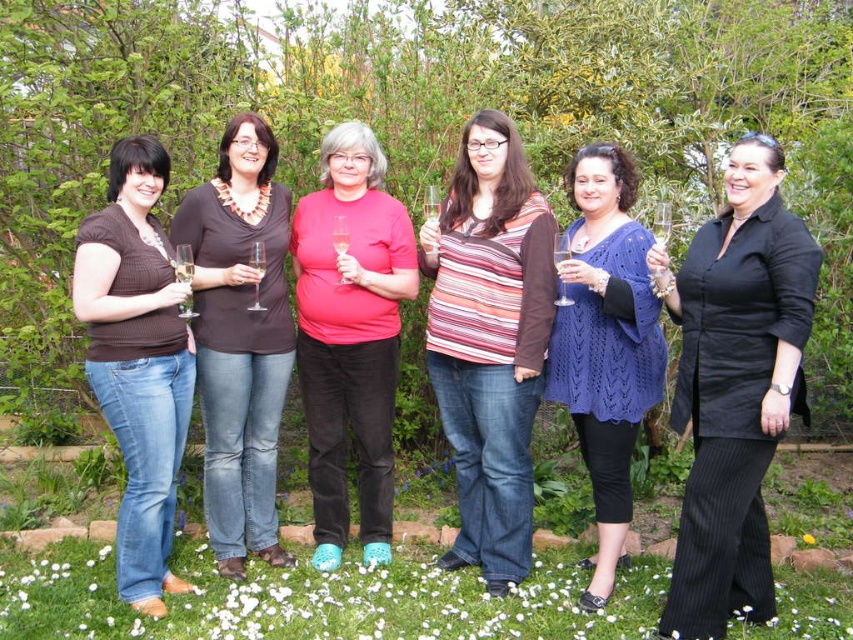
Question: Does white fabric flower at lower center have a greater width compared to yellow fabric flower at center?

Choices:
 (A) yes
 (B) no

Answer: (A)

Question: Which object is positioned closest to the striped knit top at center?

Choices:
 (A) matte brown blouse at center
 (B) knitted blue sweater at center

Answer: (B)

Question: Which object is farther from the camera taking this photo?

Choices:
 (A) matte brown shirt at left
 (B) black pinstripe dress at right

Answer: (A)

Question: Among these points, which one is farthest from the camera?

Choices:
 (A) (608, 230)
 (B) (173, 456)

Answer: (A)

Question: Can you confirm if black pinstripe dress at right is smaller than yellow fabric flower at center?

Choices:
 (A) yes
 (B) no

Answer: (B)

Question: From the image, what is the correct spatial relationship of white fabric flower at lower center in relation to matte pink shirt at center?

Choices:
 (A) right
 (B) left

Answer: (B)